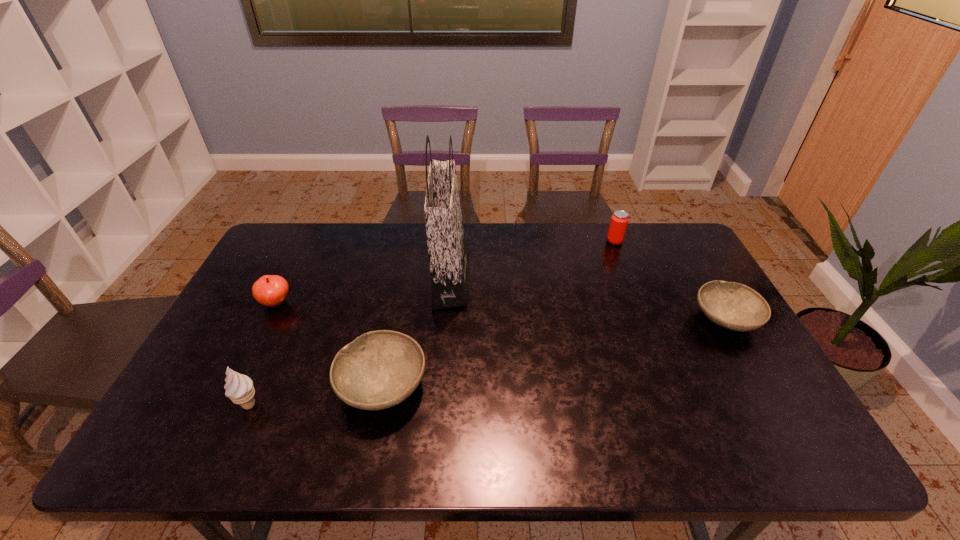
Please point a spot to place another bowl for symmetrical spacing. Please provide its 2D coordinates. Your answer should be formatted as a tuple, i.e. [(x, y)], where the tuple contains the x and y coordinates of a point satisfying the conditions above.

[(566, 350)]